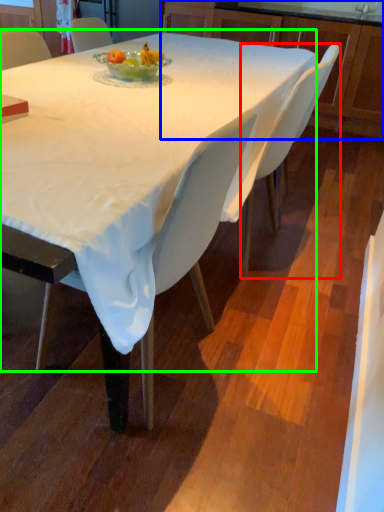
Question: Which object is the closest to the chair (highlighted by a red box)? Choose among these: cabinetry (highlighted by a blue box) or round table (highlighted by a green box).

Choices:
 (A) cabinetry
 (B) round table

Answer: (B)